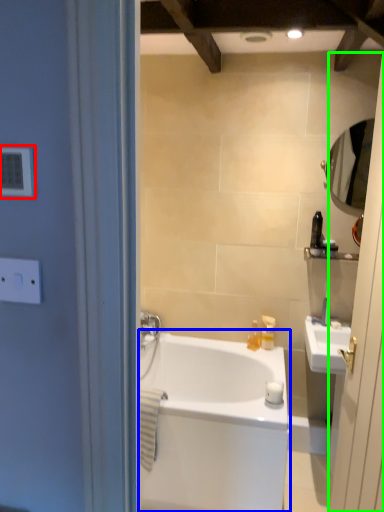
Question: Considering the real-world distances, which object is closest to light switch (highlighted by a red box)? bathtub (highlighted by a blue box) or screen door (highlighted by a green box).

Choices:
 (A) bathtub
 (B) screen door

Answer: (B)